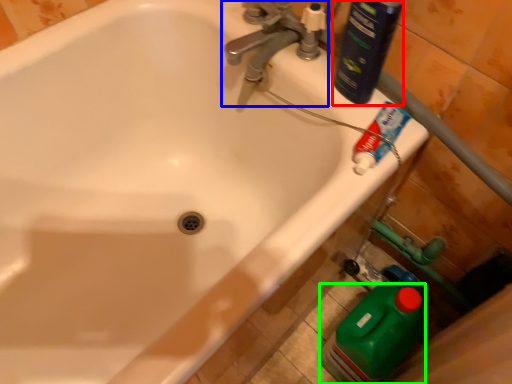
Question: Estimate the real-world distances between objects in this image. Which object is farther from cleaning product (highlighted by a red box), tap (highlighted by a blue box) or cleaning product (highlighted by a green box)?

Choices:
 (A) tap
 (B) cleaning product

Answer: (B)